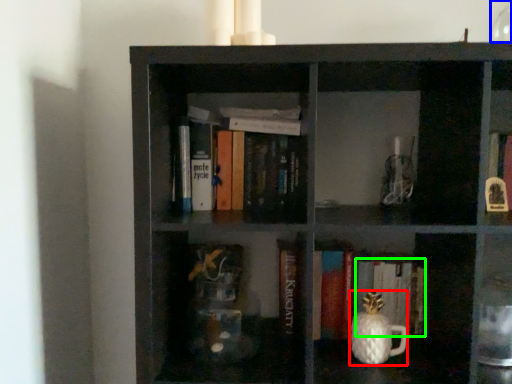
Question: Which object is the farthest from tea pot (highlighted by a red box)? Choose among these: glass vase (highlighted by a blue box) or book (highlighted by a green box).

Choices:
 (A) glass vase
 (B) book

Answer: (A)